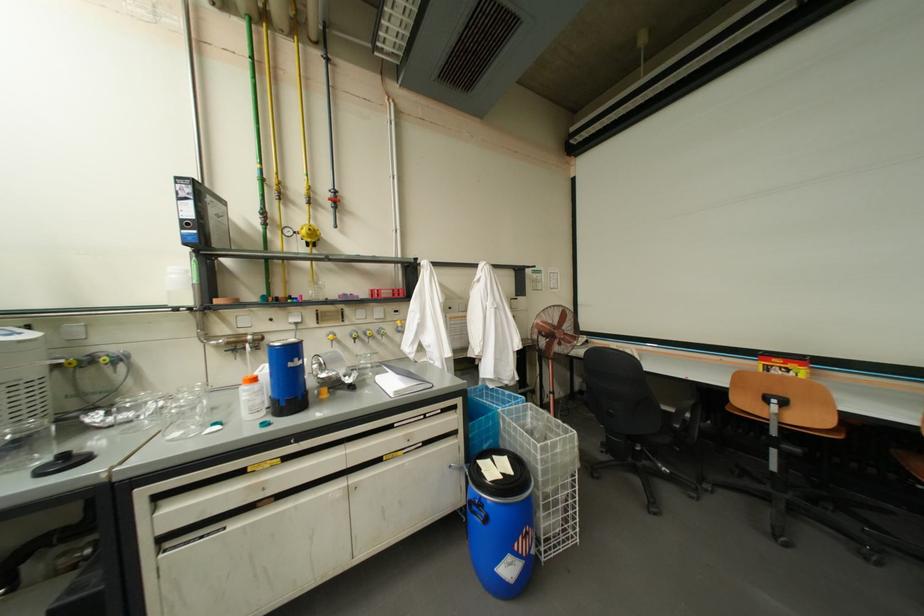
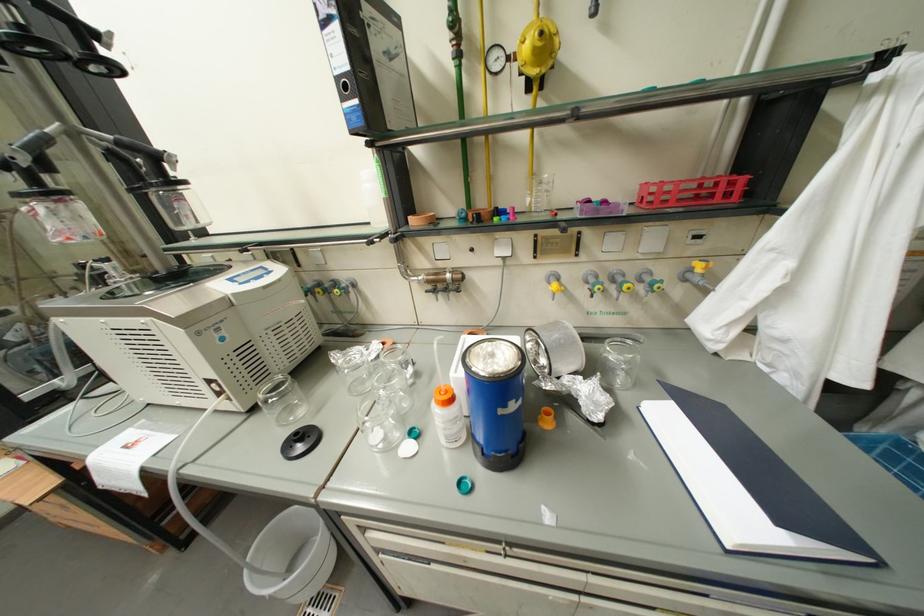
The images are taken continuously from a first-person perspective. In which direction is your viewpoint rotating?

The rotation direction of the camera is left-down.